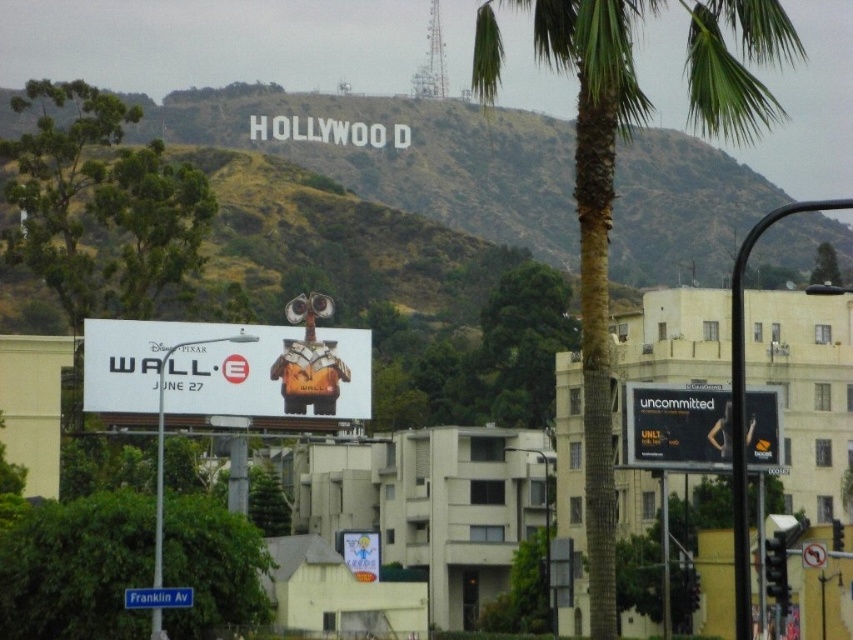
Question: Among these objects, which one is farthest from the camera?

Choices:
 (A) black glossy billboard at right
 (B) green leafy tree at upper left
 (C) green leafy tree at center

Answer: (C)

Question: Does blue plastic street sign at lower left appear on the right side of green leafy tree at center?

Choices:
 (A) yes
 (B) no

Answer: (B)

Question: Where is black glossy billboard at right located in relation to blue plastic street sign at lower left in the image?

Choices:
 (A) below
 (B) above

Answer: (B)

Question: Which of the following is the closest to the observer?

Choices:
 (A) metallic robot at center
 (B) matte plastic toy at center

Answer: (A)

Question: Based on their relative distances, which object is nearer to the blue plastic street sign at lower left?

Choices:
 (A) green leafy bush at lower left
 (B) matte plastic toy at center
 (C) black glossy billboard at right

Answer: (A)

Question: Does matte plastic toy at center lie behind green leafy tree at center?

Choices:
 (A) no
 (B) yes

Answer: (A)